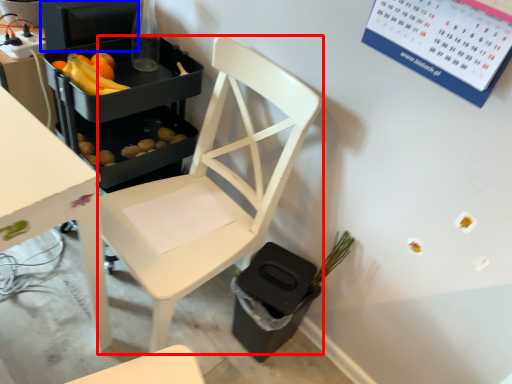
Question: Which object is further to the camera taking this photo, chair (highlighted by a red box) or appliance (highlighted by a blue box)?

Choices:
 (A) chair
 (B) appliance

Answer: (B)